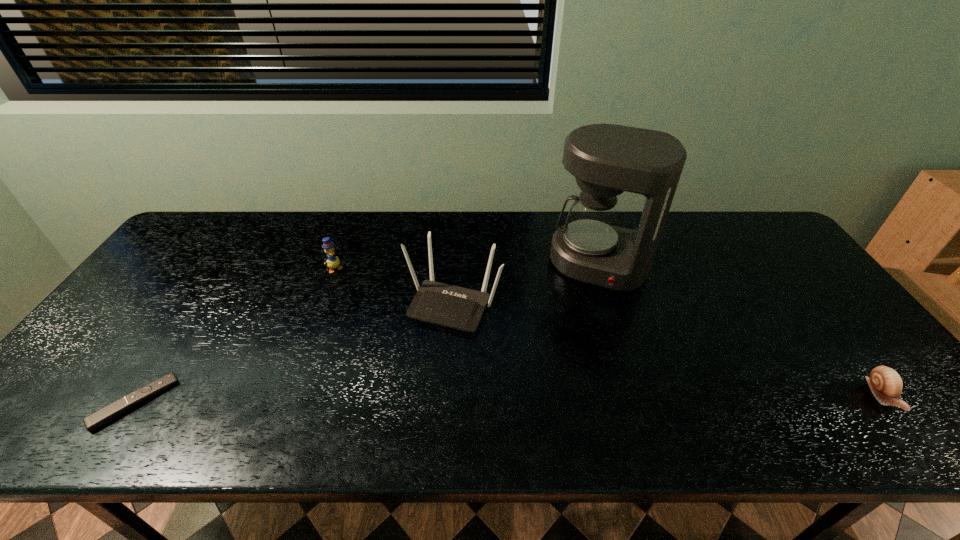
Identify the location of free space at the right edge of the desktop. (836, 313).

I want to click on vacant space at the far left corner of the desktop, so click(x=221, y=217).

What are the coordinates of `vacant space at the far right corner of the desktop` in the screenshot? It's located at (748, 219).

I want to click on vacant point located between the shortest object and the fourth tallest object, so click(508, 400).

Image resolution: width=960 pixels, height=540 pixels. I want to click on free space that is in between the coffee maker and the shortest object, so click(367, 333).

Locate an element on the screen. This screenshot has width=960, height=540. free space between the coffee maker and the second tallest object is located at coordinates (526, 284).

Where is `empty location between the shortest object and the escargot`? This screenshot has width=960, height=540. empty location between the shortest object and the escargot is located at coordinates (508, 400).

Where is `vacant area that lies between the fourth tallest object and the remote control`? vacant area that lies between the fourth tallest object and the remote control is located at coordinates (508, 400).

The image size is (960, 540). Identify the location of vacant area that lies between the leftmost object and the third object from right to left. (294, 353).

I want to click on empty location between the third tallest object and the router, so click(x=395, y=286).